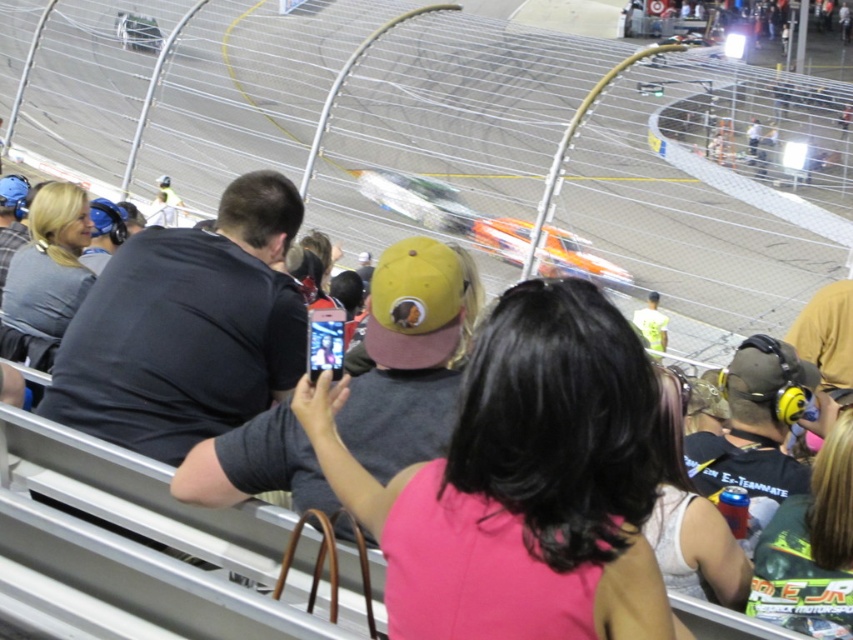
You are a photographer at the stock car race. You want to capture a photo of the bright orange race car on the smooth asphalt race track at center while also including the pink fabric shirt at center in the frame. Can you position yourself so that both are visible in the same photo?

The smooth asphalt race track at center is located above the pink fabric shirt at center, so yes, you can position yourself to capture both the bright orange race car on the track above and the pink fabric shirt at center in the same photo.

You are a photographer at the motorsport event and want to capture both the smooth asphalt race track at center and the pink fabric shirt at center in a single photo. Which object should you focus on first to ensure both are in frame?

You should focus on the smooth asphalt race track at center first because it is larger in size than the pink fabric shirt at center, allowing you to frame it while still including the smaller pink fabric shirt at center in the shot.

What is the exact coordinate of the smooth asphalt race track at center?

The smooth asphalt race track at center is located at point (463, 141).